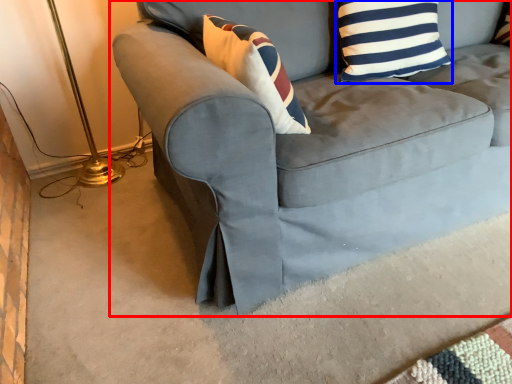
Question: Which point is closer to the camera, studio couch (highlighted by a red box) or pillow (highlighted by a blue box)?

Choices:
 (A) studio couch
 (B) pillow

Answer: (A)